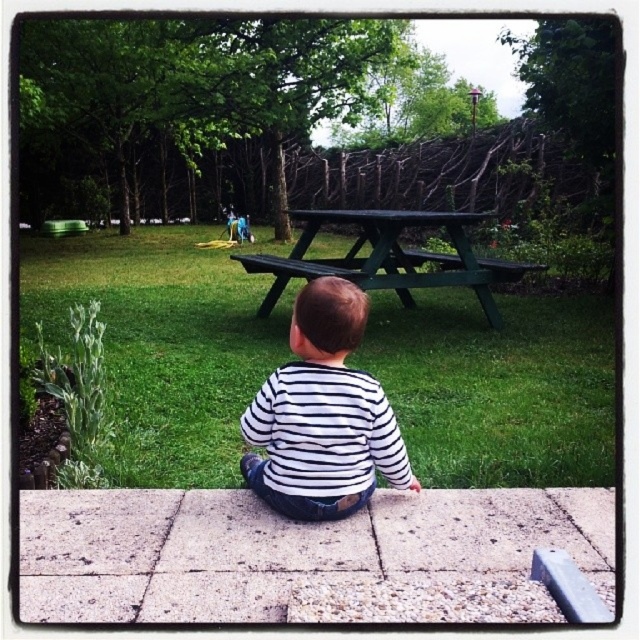
Question: Which point is farther to the camera?

Choices:
 (A) green matte picnic table at center
 (B) striped cotton shirt at center

Answer: (A)

Question: Can you confirm if green grass at center is wider than striped cotton shirt at center?

Choices:
 (A) no
 (B) yes

Answer: (B)

Question: Observing the image, what is the correct spatial positioning of striped cotton shirt at center in reference to green matte picnic table at center?

Choices:
 (A) above
 (B) below

Answer: (B)

Question: Which of the following is the closest to the observer?

Choices:
 (A) green grass at center
 (B) green matte picnic table at center
 (C) striped cotton shirt at center

Answer: (C)

Question: Which object appears farthest from the camera in this image?

Choices:
 (A) striped cotton shirt at center
 (B) green matte picnic table at center

Answer: (B)

Question: Is striped cotton shirt at center below green matte picnic table at center?

Choices:
 (A) no
 (B) yes

Answer: (B)